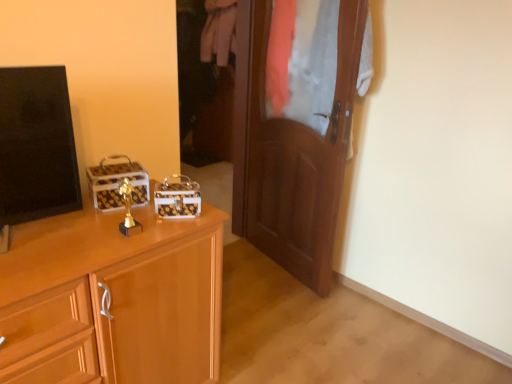
Identify the location of free point below wooden door at center (from a real-world perspective). This screenshot has height=384, width=512. coord(278,266).